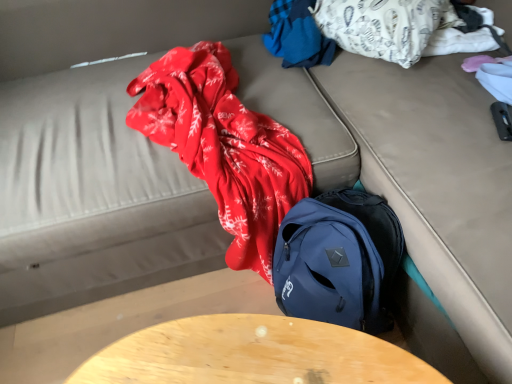
The width and height of the screenshot is (512, 384). Describe the element at coordinates (297, 35) in the screenshot. I see `blue fabric at upper center, arranged as the 2th clothing when viewed from the right` at that location.

Identify the location of blue fabric at upper center, which is the first clothing from left to right. coord(297,35).

Consider the image. From a real-world perspective, is white cotton blanket at upper right, which is the 1th clothing in right-to-left order, on top of wooden table at center?

Correct, in the physical world, white cotton blanket at upper right, which is the 1th clothing in right-to-left order, is higher than wooden table at center.

Is the depth of white cotton blanket at upper right, which is the 1th clothing in right-to-left order, less than that of wooden table at center?

That is False.

Is white cotton blanket at upper right, the second clothing when ordered from left to right, not inside wooden table at center?

white cotton blanket at upper right, the second clothing when ordered from left to right, is positioned outside wooden table at center.

Measure the distance from white cotton blanket at upper right, which is the 1th clothing in right-to-left order, to wooden table at center.

white cotton blanket at upper right, which is the 1th clothing in right-to-left order, and wooden table at center are 1.04 meters apart from each other.

Who is shorter, wooden table at center or white cotton blanket at upper right, which is the 1th clothing in right-to-left order?

white cotton blanket at upper right, which is the 1th clothing in right-to-left order.

How different are the orientations of wooden table at center and white cotton blanket at upper right, the second clothing when ordered from left to right, in degrees?

They differ by 21.9 degrees in their facing directions.

Which of these two, wooden table at center or white cotton blanket at upper right, the second clothing when ordered from left to right, is wider?

Wider between the two is white cotton blanket at upper right, the second clothing when ordered from left to right.

Is wooden table at center at the right side of white cotton blanket at upper right, the second clothing when ordered from left to right?

No.

From a real-world perspective, is wooden table at center physically located above or below blue fabric at upper center, which is the first clothing from left to right?

wooden table at center is situated lower than blue fabric at upper center, which is the first clothing from left to right, in the real world.

Is wooden table at center to the left of blue fabric at upper center, which is the first clothing from left to right, from the viewer's perspective?

Yes.

Identify the location of table below the blue fabric at upper center, arranged as the 2th clothing when viewed from the right (from the image's perspective). The height and width of the screenshot is (384, 512). (253, 354).

Is wooden table at center not close to blue fabric at upper center, which is the first clothing from left to right?

wooden table at center is positioned a significant distance from blue fabric at upper center, which is the first clothing from left to right.

Which is more to the right, blue fabric at upper center, arranged as the 2th clothing when viewed from the right, or wooden table at center?

Positioned to the right is blue fabric at upper center, arranged as the 2th clothing when viewed from the right.

Does blue fabric at upper center, which is the first clothing from left to right, turn towards wooden table at center?

Yes.

From the image's perspective, which one is positioned higher, blue fabric at upper center, which is the first clothing from left to right, or wooden table at center?

blue fabric at upper center, which is the first clothing from left to right.

Does blue fabric at upper center, which is the first clothing from left to right, have a smaller size compared to wooden table at center?

Yes, blue fabric at upper center, which is the first clothing from left to right, is smaller than wooden table at center.

Looking at this image, which point is more distant from viewer, (340,23) or (310,36)?

Point (310,36)

Considering the sizes of objects white cotton blanket at upper right, which is the 1th clothing in right-to-left order, and blue fabric at upper center, arranged as the 2th clothing when viewed from the right, in the image provided, who is wider, white cotton blanket at upper right, which is the 1th clothing in right-to-left order, or blue fabric at upper center, arranged as the 2th clothing when viewed from the right,?

white cotton blanket at upper right, which is the 1th clothing in right-to-left order, is wider.

Looking at this image, considering their positions, is white cotton blanket at upper right, which is the 1th clothing in right-to-left order, located in front of or behind blue fabric at upper center, arranged as the 2th clothing when viewed from the right?

white cotton blanket at upper right, which is the 1th clothing in right-to-left order, is positioned closer to the viewer than blue fabric at upper center, arranged as the 2th clothing when viewed from the right.

Can you tell me how much blue fabric at upper center, which is the first clothing from left to right, and white cotton blanket at upper right, which is the 1th clothing in right-to-left order, differ in facing direction?

22 degrees separate the facing orientations of blue fabric at upper center, which is the first clothing from left to right, and white cotton blanket at upper right, which is the 1th clothing in right-to-left order.

Considering the sizes of objects blue fabric at upper center, which is the first clothing from left to right, and white cotton blanket at upper right, the second clothing when ordered from left to right, in the image provided, who is bigger, blue fabric at upper center, which is the first clothing from left to right, or white cotton blanket at upper right, the second clothing when ordered from left to right,?

With larger size is white cotton blanket at upper right, the second clothing when ordered from left to right.

Between blue fabric at upper center, arranged as the 2th clothing when viewed from the right, and white cotton blanket at upper right, the second clothing when ordered from left to right, which one has less height?

With less height is blue fabric at upper center, arranged as the 2th clothing when viewed from the right.

Who is more distant, blue fabric at upper center, arranged as the 2th clothing when viewed from the right, or white cotton blanket at upper right, which is the 1th clothing in right-to-left order?

blue fabric at upper center, arranged as the 2th clothing when viewed from the right, is behind.

Identify the location of the 1st clothing behind the wooden table at center, starting your count from the anchor. This screenshot has width=512, height=384. pyautogui.click(x=384, y=26).

From a real-world perspective, starting from the wooden table at center, which clothing is the 2nd one vertically above it? Please provide its 2D coordinates.

[(384, 26)]

When comparing their distances from blue fabric at upper center, arranged as the 2th clothing when viewed from the right, does white cotton blanket at upper right, the second clothing when ordered from left to right, or wooden table at center seem closer?

white cotton blanket at upper right, the second clothing when ordered from left to right, is closer to blue fabric at upper center, arranged as the 2th clothing when viewed from the right.

Estimate the real-world distances between objects in this image. Which object is closer to wooden table at center, white cotton blanket at upper right, the second clothing when ordered from left to right, or blue fabric at upper center, which is the first clothing from left to right?

blue fabric at upper center, which is the first clothing from left to right, is positioned closer to the anchor wooden table at center.

From the image, which object appears to be farther from white cotton blanket at upper right, which is the 1th clothing in right-to-left order, blue fabric at upper center, arranged as the 2th clothing when viewed from the right, or wooden table at center?

The object further to white cotton blanket at upper right, which is the 1th clothing in right-to-left order, is wooden table at center.

When comparing their distances from wooden table at center, does blue fabric at upper center, arranged as the 2th clothing when viewed from the right, or white cotton blanket at upper right, the second clothing when ordered from left to right, seem closer?

Based on the image, blue fabric at upper center, arranged as the 2th clothing when viewed from the right, appears to be nearer to wooden table at center.

Based on their spatial positions, is wooden table at center or white cotton blanket at upper right, which is the 1th clothing in right-to-left order, closer to blue fabric at upper center, arranged as the 2th clothing when viewed from the right?

white cotton blanket at upper right, which is the 1th clothing in right-to-left order.

Looking at the image, which one is located further to white cotton blanket at upper right, the second clothing when ordered from left to right, wooden table at center or blue fabric at upper center, arranged as the 2th clothing when viewed from the right?

wooden table at center lies further to white cotton blanket at upper right, the second clothing when ordered from left to right, than the other object.

Where is `clothing that lies between blue fabric at upper center, which is the first clothing from left to right, and wooden table at center from top to bottom`? The image size is (512, 384). clothing that lies between blue fabric at upper center, which is the first clothing from left to right, and wooden table at center from top to bottom is located at coordinates (384, 26).